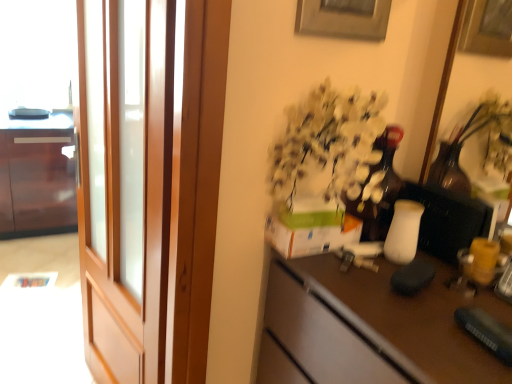
Question: Can you confirm if glossy wood cabinet at left is thinner than brown matte desk at center?

Choices:
 (A) no
 (B) yes

Answer: (A)

Question: Can you confirm if glossy wood cabinet at left is positioned to the left of brown matte desk at center?

Choices:
 (A) yes
 (B) no

Answer: (A)

Question: Considering the relative sizes of glossy wood cabinet at left and brown matte desk at center in the image provided, is glossy wood cabinet at left smaller than brown matte desk at center?

Choices:
 (A) no
 (B) yes

Answer: (A)

Question: Is glossy wood cabinet at left bigger than brown matte desk at center?

Choices:
 (A) no
 (B) yes

Answer: (B)

Question: Is glossy wood cabinet at left far away from brown matte desk at center?

Choices:
 (A) no
 (B) yes

Answer: (B)

Question: From a real-world perspective, is brown matte desk at center physically located above or below wooden screen door at left?

Choices:
 (A) below
 (B) above

Answer: (A)

Question: From the image's perspective, is brown matte desk at center above or below wooden screen door at left?

Choices:
 (A) below
 (B) above

Answer: (A)

Question: Considering their positions, is brown matte desk at center located in front of or behind wooden screen door at left?

Choices:
 (A) behind
 (B) front

Answer: (B)

Question: Is brown matte desk at center wider or thinner than wooden screen door at left?

Choices:
 (A) thin
 (B) wide

Answer: (B)

Question: From a real-world perspective, is wooden screen door at left positioned above or below brown matte desk at center?

Choices:
 (A) above
 (B) below

Answer: (A)

Question: In terms of size, does wooden screen door at left appear bigger or smaller than brown matte desk at center?

Choices:
 (A) big
 (B) small

Answer: (B)

Question: Is wooden screen door at left in front of or behind brown matte desk at center in the image?

Choices:
 (A) behind
 (B) front

Answer: (A)

Question: Would you say wooden screen door at left is inside or outside brown matte desk at center?

Choices:
 (A) inside
 (B) outside

Answer: (B)

Question: Would you say wooden screen door at left is inside or outside glossy wood cabinet at left?

Choices:
 (A) outside
 (B) inside

Answer: (A)

Question: In terms of size, does wooden screen door at left appear bigger or smaller than glossy wood cabinet at left?

Choices:
 (A) small
 (B) big

Answer: (A)